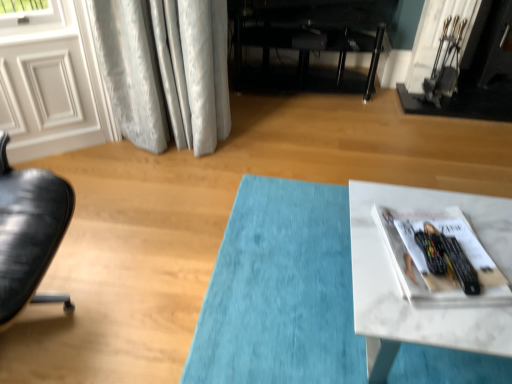
Locate an element on the screen. The height and width of the screenshot is (384, 512). free space to the back side of white glossy magazine at lower right is located at coordinates (413, 199).